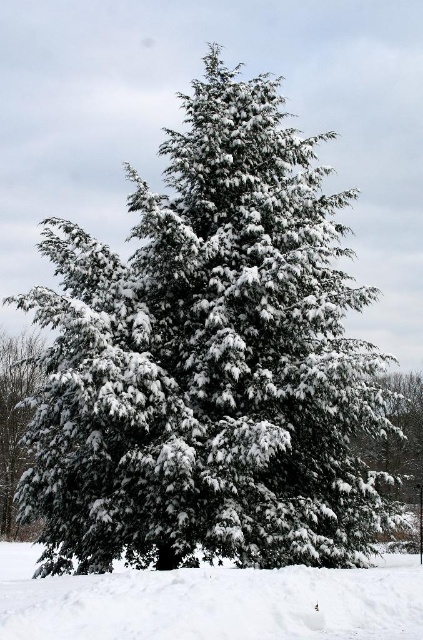
Question: Which point is farther to the camera?

Choices:
 (A) snow-covered pine tree at left
 (B) white fluffy snow at lower center

Answer: (A)

Question: Is white fluffy snow at lower center above snow-covered pine tree at left?

Choices:
 (A) no
 (B) yes

Answer: (A)

Question: Can you confirm if white fluffy snow at lower center is bigger than snow-covered pine tree at left?

Choices:
 (A) yes
 (B) no

Answer: (A)

Question: Is white fluffy snow at lower center bigger than snow-covered pine tree at left?

Choices:
 (A) no
 (B) yes

Answer: (B)

Question: Which point is farther to the camera?

Choices:
 (A) white fluffy snow at lower center
 (B) snow-covered pine tree at left

Answer: (B)